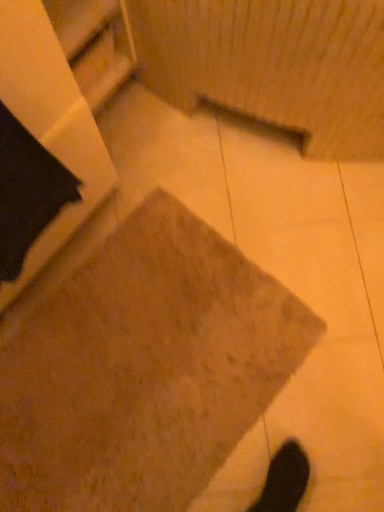
Question: Is brown textured concrete at center not near wooden shelf at upper left?

Choices:
 (A) yes
 (B) no

Answer: (B)

Question: Considering the relative positions of brown textured concrete at center and wooden shelf at upper left in the image provided, is brown textured concrete at center to the right of wooden shelf at upper left from the viewer's perspective?

Choices:
 (A) no
 (B) yes

Answer: (B)

Question: From the image's perspective, would you say brown textured concrete at center is positioned over wooden shelf at upper left?

Choices:
 (A) yes
 (B) no

Answer: (B)

Question: Is brown textured concrete at center with wooden shelf at upper left?

Choices:
 (A) no
 (B) yes

Answer: (A)

Question: Is brown textured concrete at center behind wooden shelf at upper left?

Choices:
 (A) yes
 (B) no

Answer: (A)

Question: From the image's perspective, is brown textured concrete at center below wooden shelf at upper left?

Choices:
 (A) yes
 (B) no

Answer: (A)

Question: Could you tell me if wooden shelf at upper left is turned towards brown textured concrete at center?

Choices:
 (A) no
 (B) yes

Answer: (A)

Question: From the image's perspective, is wooden shelf at upper left above brown textured concrete at center?

Choices:
 (A) yes
 (B) no

Answer: (A)

Question: Is wooden shelf at upper left far from brown textured concrete at center?

Choices:
 (A) no
 (B) yes

Answer: (A)

Question: Is brown textured concrete at center a part of wooden shelf at upper left?

Choices:
 (A) no
 (B) yes

Answer: (A)

Question: Can you confirm if wooden shelf at upper left is bigger than brown textured concrete at center?

Choices:
 (A) yes
 (B) no

Answer: (A)

Question: Considering the relative sizes of wooden shelf at upper left and brown textured concrete at center in the image provided, is wooden shelf at upper left taller than brown textured concrete at center?

Choices:
 (A) no
 (B) yes

Answer: (B)

Question: In the image, is brown textured concrete at center positioned in front of or behind wooden shelf at upper left?

Choices:
 (A) behind
 (B) front

Answer: (A)